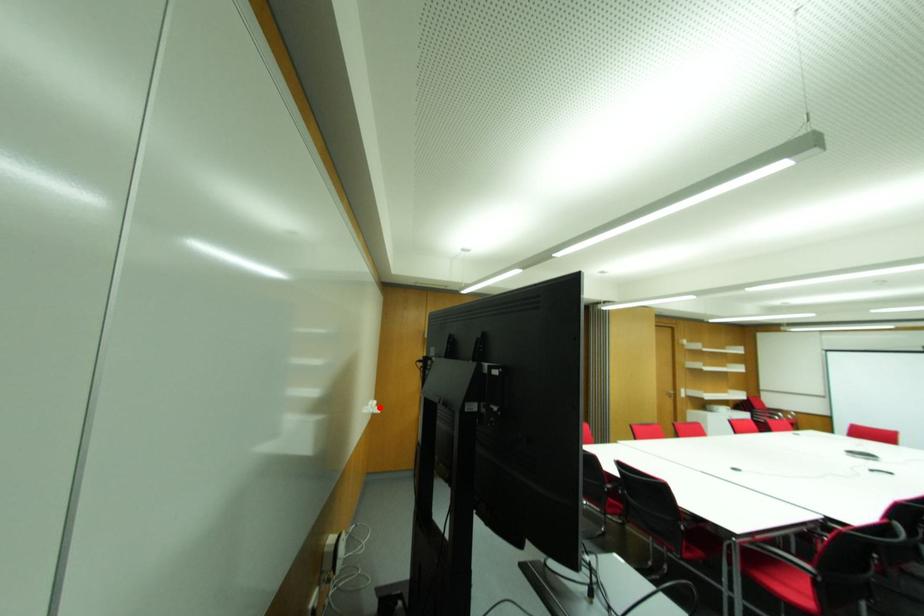
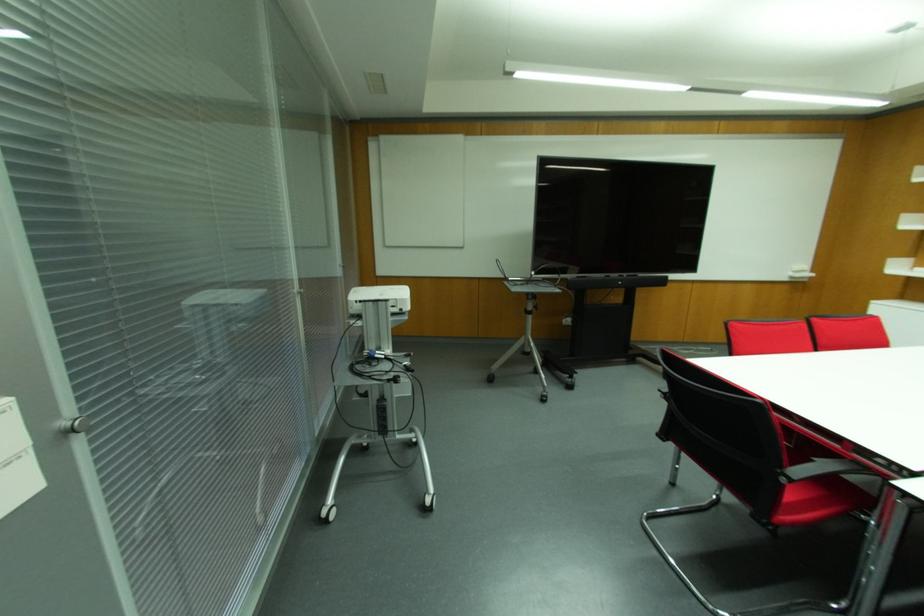
Locate, in the second image, the point that corresponds to the highlighted location in the first image.

(811, 274)